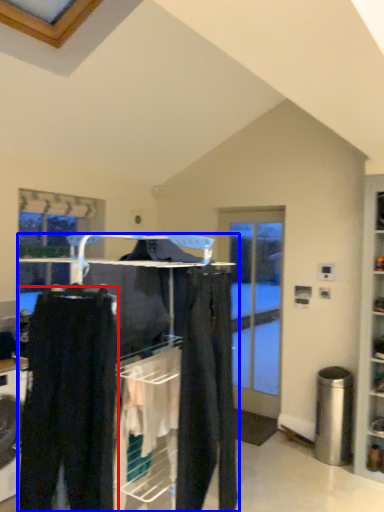
Question: Among these objects, which one is farthest to the camera, trousers (highlighted by a red box) or closet (highlighted by a blue box)?

Choices:
 (A) trousers
 (B) closet

Answer: (B)